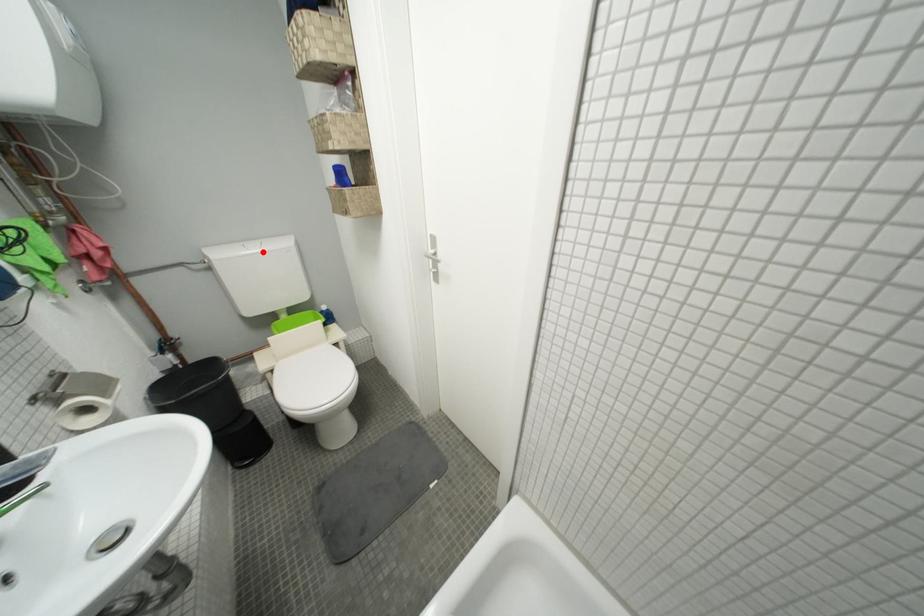
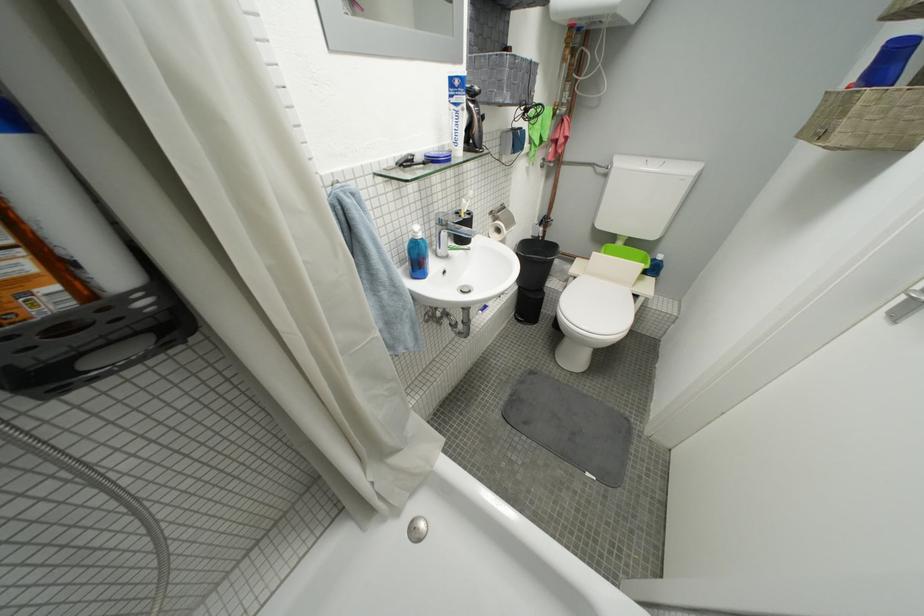
Question: I am providing you with two images of the same scene from different viewpoints. In image1, a red point is highlighted. Considering the same 3D point in image2, which of the following is correct?

Choices:
 (A) It is closer
 (B) It is farther

Answer: (A)